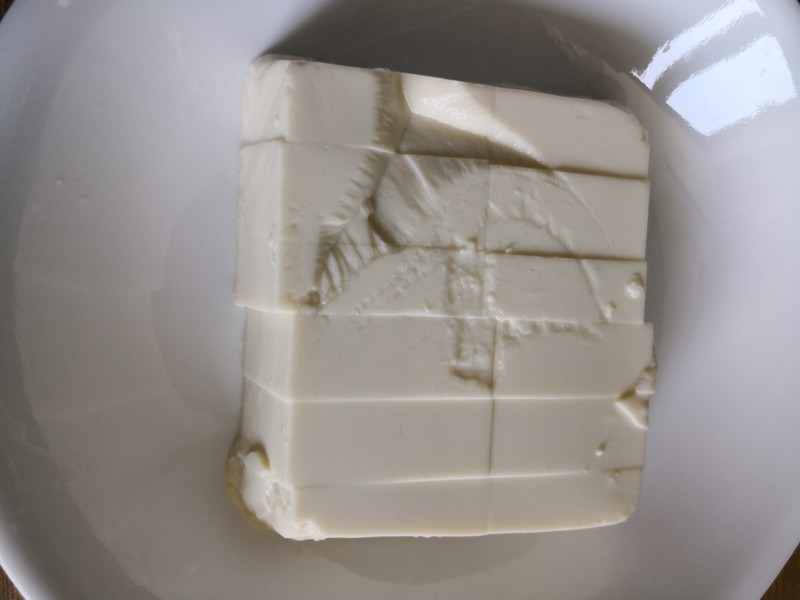
Locate an element on the screen. table is located at coordinates (5, 586), (790, 585), (4, 7).